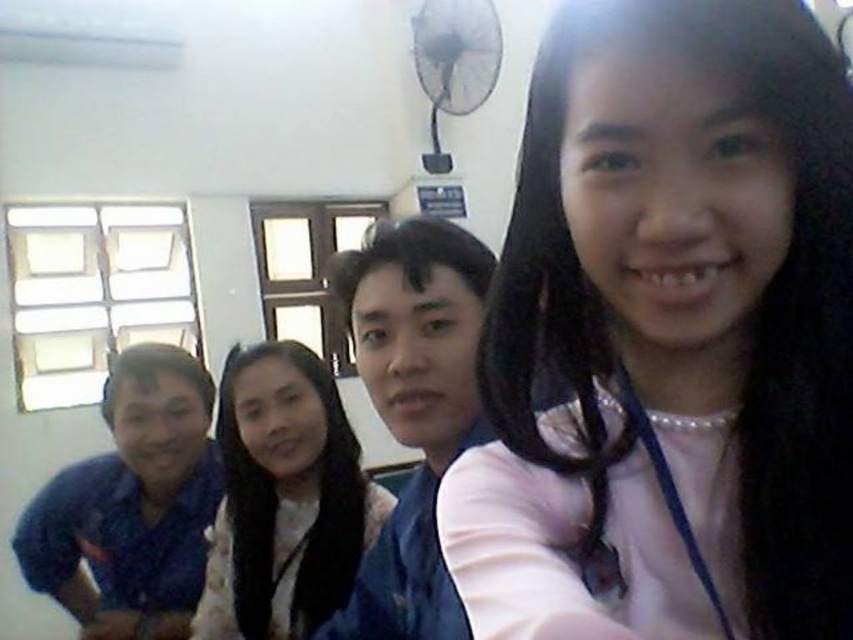
Question: Is pink fabric at center below smooth white shirt at center?

Choices:
 (A) yes
 (B) no

Answer: (B)

Question: Which object is positioned closest to the blue denim jacket at center?

Choices:
 (A) smooth white shirt at center
 (B) pink fabric at center

Answer: (A)

Question: Is pink fabric at center closer to the viewer compared to blue denim jacket at center?

Choices:
 (A) no
 (B) yes

Answer: (B)

Question: Among these points, which one is nearest to the camera?

Choices:
 (A) [x=442, y=624]
 (B) [x=256, y=525]
 (C) [x=566, y=320]

Answer: (C)

Question: Which of the following is the closest to the observer?

Choices:
 (A) (276, 589)
 (B) (422, 362)

Answer: (B)

Question: Can you confirm if pink fabric at center is smaller than blue denim jacket at center?

Choices:
 (A) no
 (B) yes

Answer: (B)